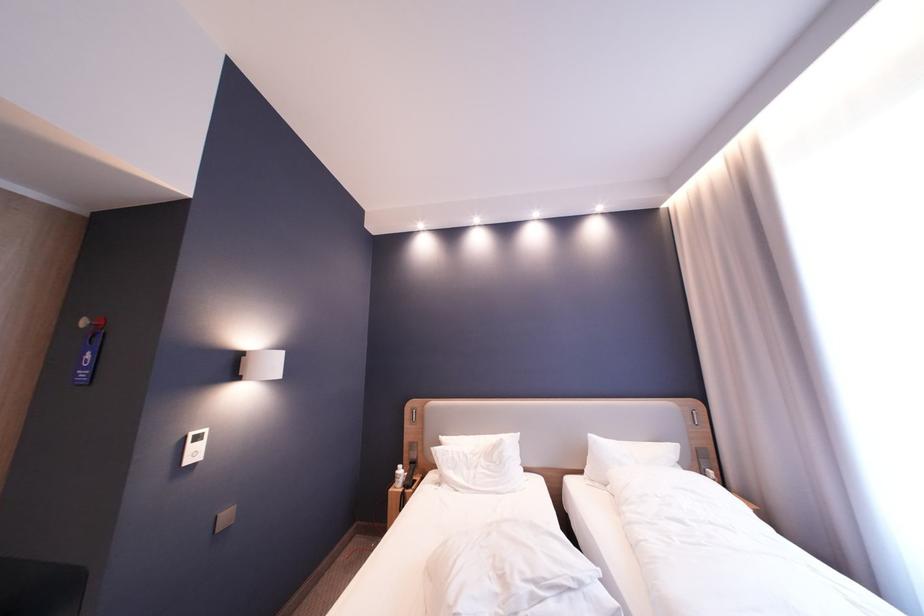
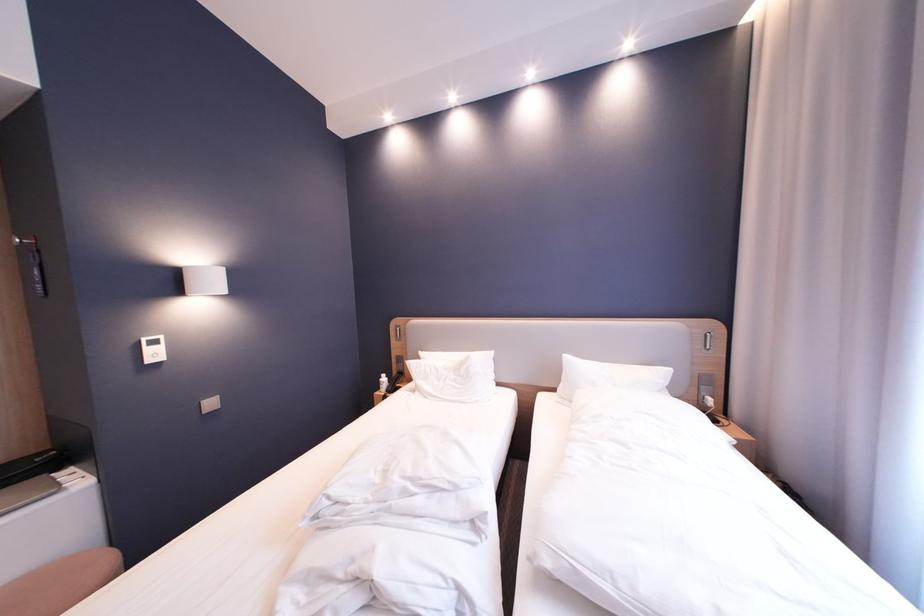
Where in the second image is the point corresponding to point (591, 472) from the first image?

(565, 391)